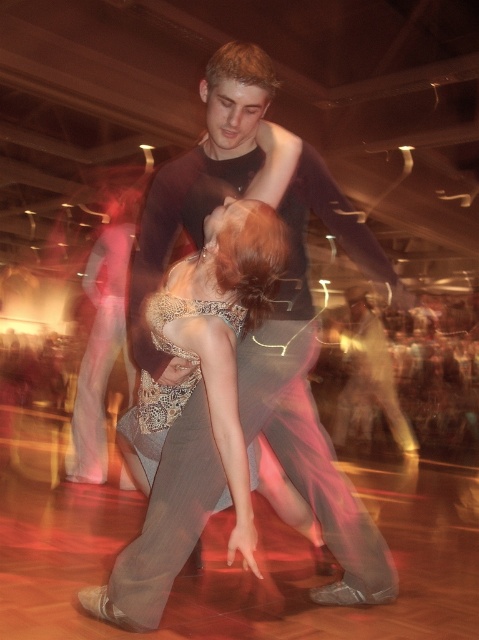
You are a photographer at a ballroom dance event. You need to capture a photo of the two dancers wearing the satin silver dress at center and light gray pants at center. However, you want to ensure that the dress is clearly visible in the photo. Based on their positions, can you determine if the dress will be visible in front of the pants?

The satin silver dress at center is positioned over light gray pants at center, so yes, the dress will be visible in front of the pants, making it clearly visible in the photo.